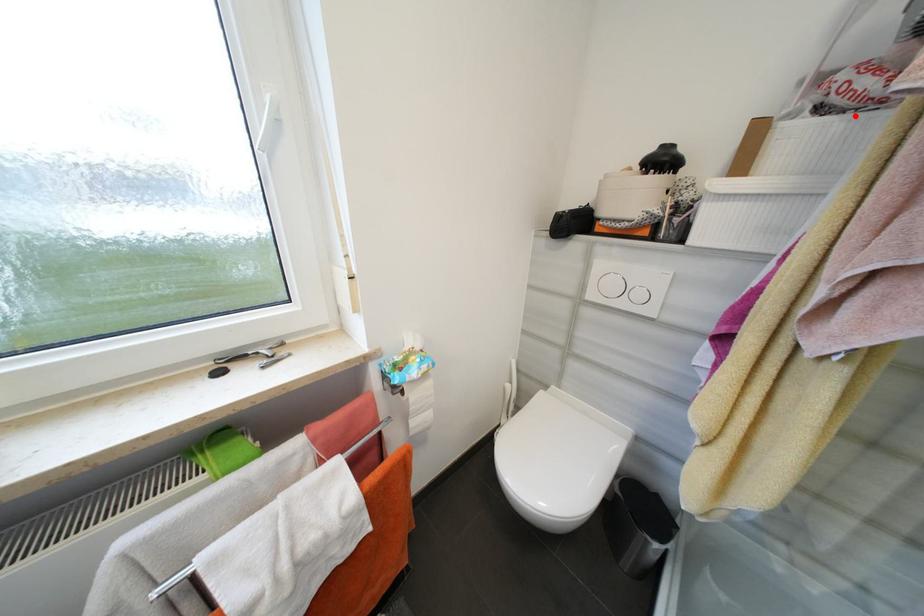
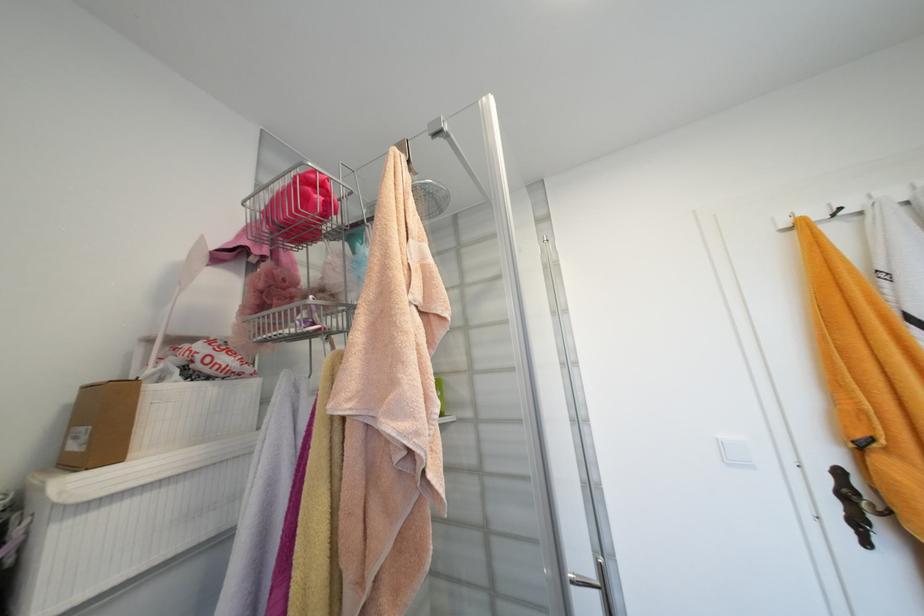
Where in the second image is the point corresponding to the highlighted location from the first image?

(224, 383)